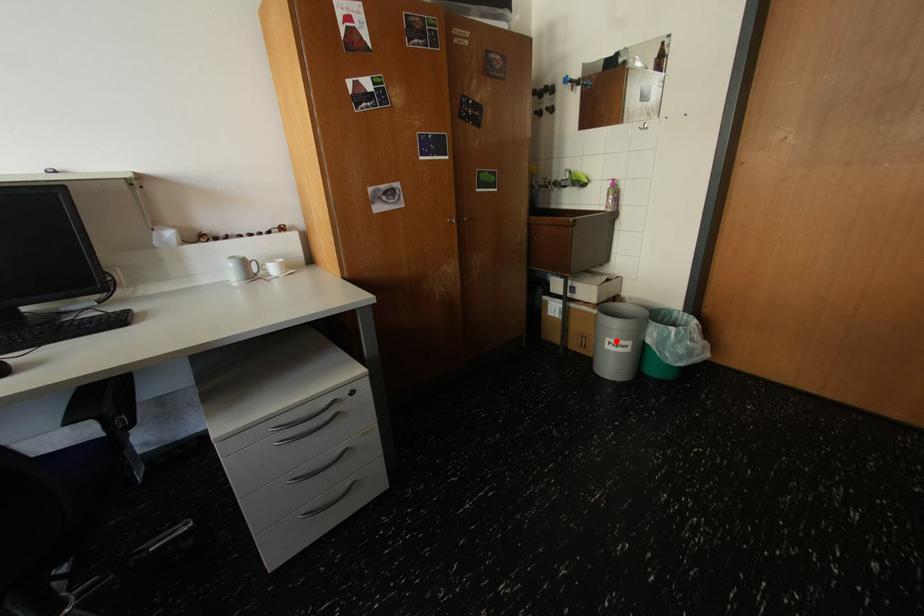
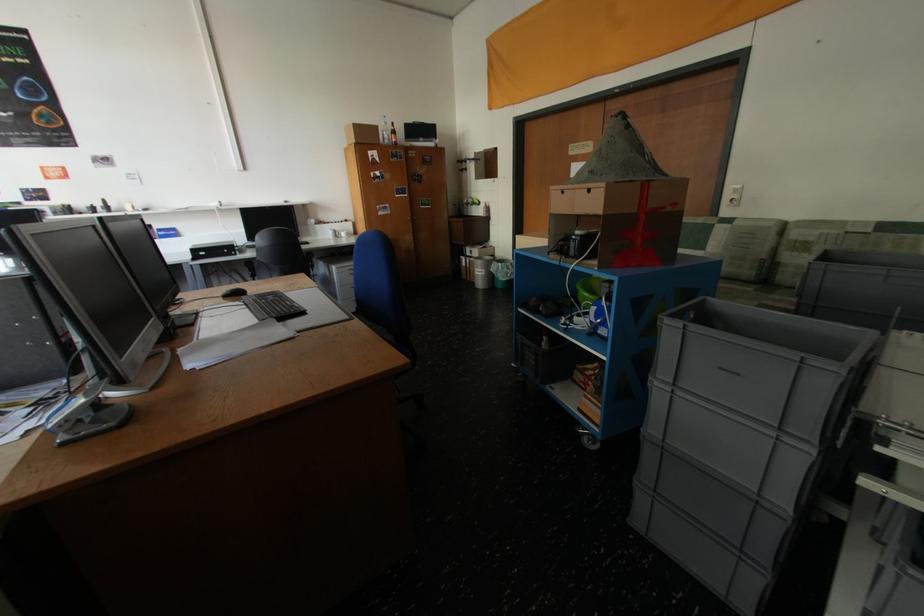
Question: A red point is marked in image1. In image2, is the corresponding 3D point closer to the camera or farther? Reply with the corresponding letter.

Choices:
 (A) The corresponding 3D point is closer.
 (B) The corresponding 3D point is farther.

Answer: (B)